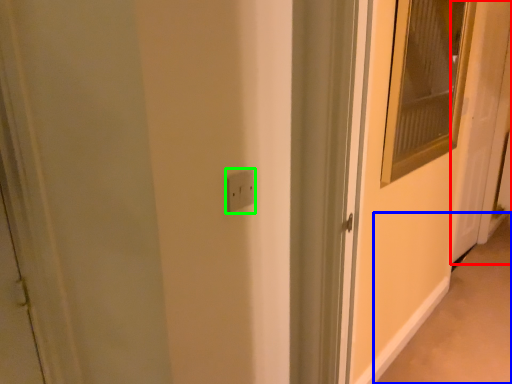
Question: Which object is positioned closest to door (highlighted by a red box)? Select from alley (highlighted by a blue box) and electric outlet (highlighted by a green box).

Choices:
 (A) alley
 (B) electric outlet

Answer: (A)